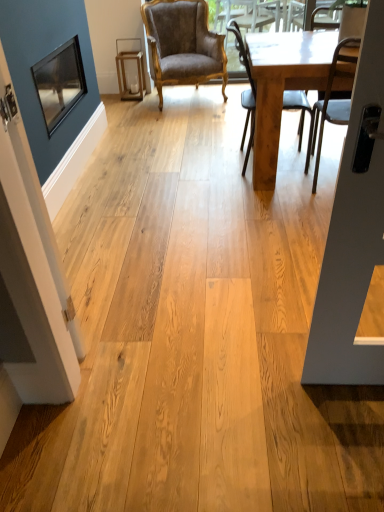
Question: Is matte black screen door at left taller than light brown wooden table at right?

Choices:
 (A) yes
 (B) no

Answer: (A)

Question: From a real-world perspective, is matte black screen door at left positioned under light brown wooden table at right based on gravity?

Choices:
 (A) yes
 (B) no

Answer: (B)

Question: Does matte black screen door at left have a smaller size compared to light brown wooden table at right?

Choices:
 (A) yes
 (B) no

Answer: (A)

Question: Is matte black screen door at left looking in the opposite direction of light brown wooden table at right?

Choices:
 (A) yes
 (B) no

Answer: (B)

Question: Is matte black screen door at left thinner than light brown wooden table at right?

Choices:
 (A) yes
 (B) no

Answer: (A)

Question: From a real-world perspective, is metallic silver chair at right, which is the 3th chair from back to front, physically located above or below velvet brown armchair at center, arranged as the third chair when viewed from the front?

Choices:
 (A) below
 (B) above

Answer: (B)

Question: In the image, is metallic silver chair at right, which is the 1th chair in right-to-left order, positioned in front of or behind velvet brown armchair at center, which is the third chair from right to left?

Choices:
 (A) front
 (B) behind

Answer: (A)

Question: Considering the positions of metallic silver chair at right, arranged as the first chair when viewed from the front, and velvet brown armchair at center, which is the third chair from right to left, in the image, is metallic silver chair at right, arranged as the first chair when viewed from the front, bigger or smaller than velvet brown armchair at center, which is the third chair from right to left,?

Choices:
 (A) big
 (B) small

Answer: (B)

Question: Is point (340, 48) positioned closer to the camera than point (163, 47)?

Choices:
 (A) closer
 (B) farther

Answer: (A)

Question: Is velvet brown armchair at center, which appears as the first chair when viewed from the left, wider or thinner than light brown wooden table at right?

Choices:
 (A) thin
 (B) wide

Answer: (A)

Question: Which is correct: velvet brown armchair at center, which ranks as the 1th chair in back-to-front order, is inside light brown wooden table at right, or outside of it?

Choices:
 (A) inside
 (B) outside

Answer: (B)

Question: From a real-world perspective, relative to light brown wooden table at right, is velvet brown armchair at center, which ranks as the 1th chair in back-to-front order, vertically above or below?

Choices:
 (A) below
 (B) above

Answer: (B)

Question: Considering their positions, is velvet brown armchair at center, which ranks as the 1th chair in back-to-front order, located in front of or behind light brown wooden table at right?

Choices:
 (A) front
 (B) behind

Answer: (B)

Question: From the image's perspective, is metallic silver chair at right, which is the 1th chair in right-to-left order, above or below light brown wooden chair at center, marked as the 2th chair in a back-to-front arrangement?

Choices:
 (A) below
 (B) above

Answer: (A)

Question: Is point (329, 94) positioned closer to the camera than point (249, 108)?

Choices:
 (A) farther
 (B) closer

Answer: (B)